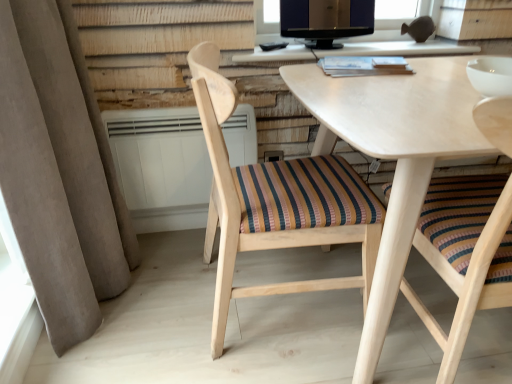
This screenshot has width=512, height=384. I want to click on vacant space in white plastic radiator at center (from a real-world perspective), so click(175, 231).